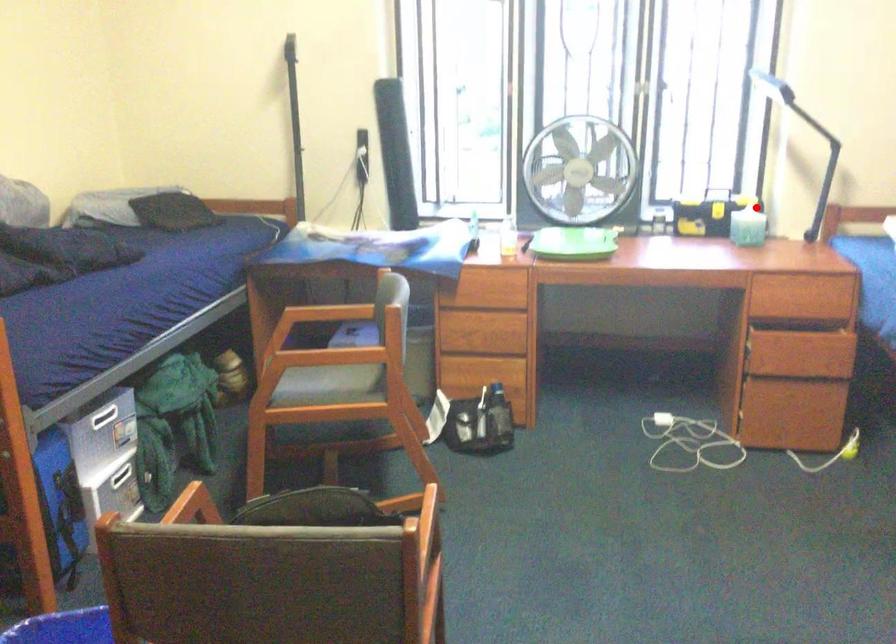
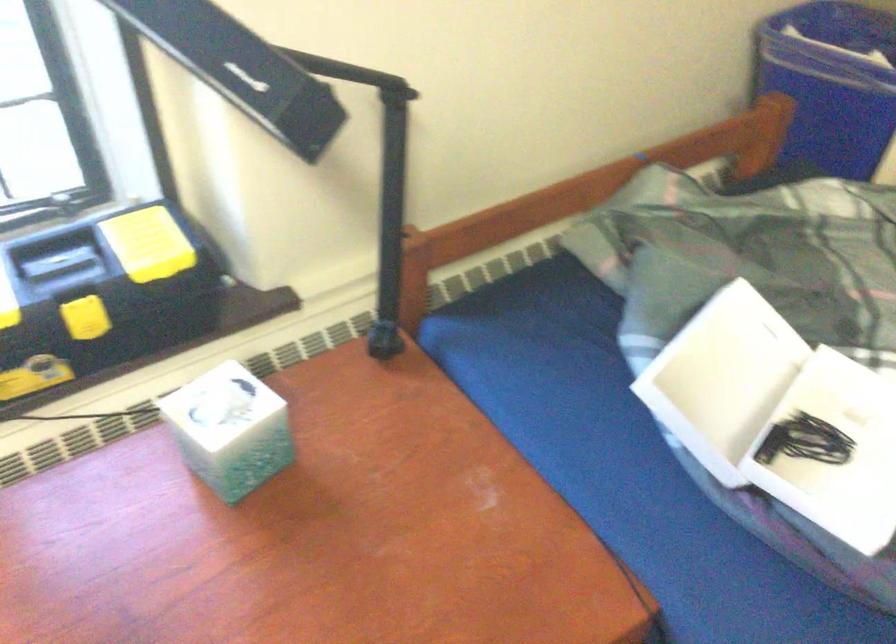
Question: A red point is marked in image1. In image2, is the corresponding 3D point closer to the camera or farther? Reply with the corresponding letter.

Choices:
 (A) The corresponding 3D point is closer.
 (B) The corresponding 3D point is farther.

Answer: (A)